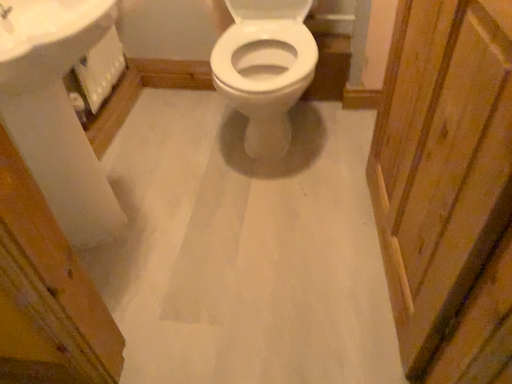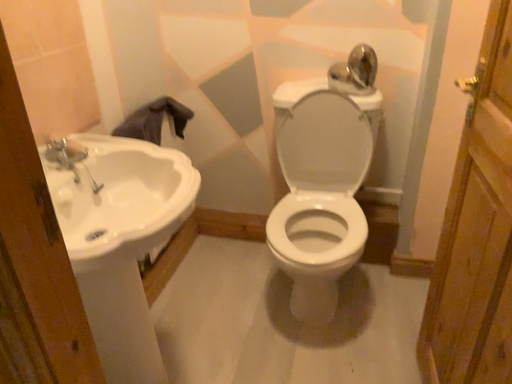
Question: How did the camera likely rotate when shooting the video?

Choices:
 (A) rotated downward
 (B) rotated upward

Answer: (B)